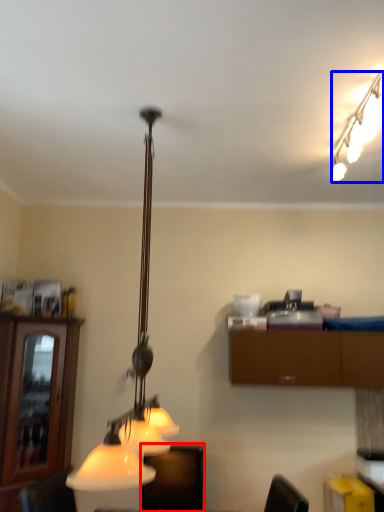
Question: Among these objects, which one is nearest to the camera, furniture (highlighted by a red box) or lamp (highlighted by a blue box)?

Choices:
 (A) furniture
 (B) lamp

Answer: (B)